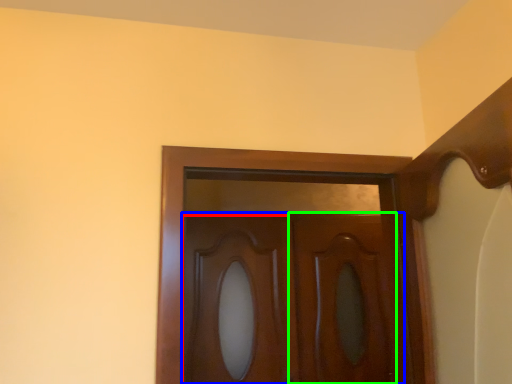
Question: Which object is positioned farthest from cabinetry (highlighted by a red box)? Select from door (highlighted by a blue box) and screen door (highlighted by a green box).

Choices:
 (A) door
 (B) screen door

Answer: (B)